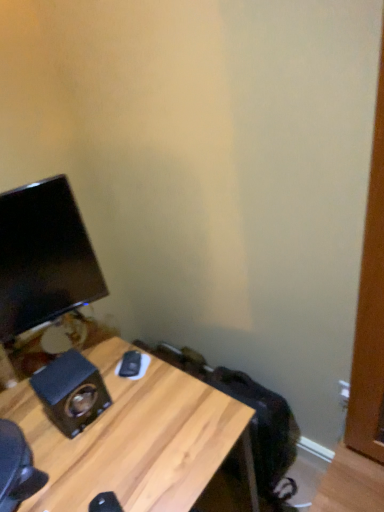
Describe the element at coordinates (44, 257) in the screenshot. I see `black glossy monitor at left` at that location.

At what (x,y) coordinates should I click in order to perform the action: click on black glossy monitor at left. Please return your answer as a coordinate pair (x, y). The height and width of the screenshot is (512, 384). Looking at the image, I should click on (44, 257).

I want to click on wooden desk at lower left, so (134, 440).

Where is `black glossy monitor at left`? This screenshot has height=512, width=384. black glossy monitor at left is located at coordinates (x=44, y=257).

Which of these two, wooden desk at lower left or wooden grain speaker at lower left, is bigger?

wooden desk at lower left is bigger.

Considering their positions, is wooden desk at lower left located in front of or behind wooden grain speaker at lower left?

Clearly, wooden desk at lower left is in front of wooden grain speaker at lower left.

Is wooden desk at lower left taller than wooden grain speaker at lower left?

Yes.

Would you consider wooden desk at lower left to be distant from wooden grain speaker at lower left?

No, wooden desk at lower left is not far away from wooden grain speaker at lower left.

From the image's perspective, which one is positioned lower, wooden desk at lower left or black glossy monitor at left?

wooden desk at lower left.

Find the location of `computer monitor that is behind the wooden desk at lower left`. computer monitor that is behind the wooden desk at lower left is located at coordinates (44, 257).

Is wooden desk at lower left far from black glossy monitor at left?

wooden desk at lower left is actually quite close to black glossy monitor at left.

Considering the sizes of objects wooden desk at lower left and black glossy monitor at left in the image provided, who is shorter, wooden desk at lower left or black glossy monitor at left?

black glossy monitor at left is shorter.

Relative to wooden desk at lower left, is black glossy monitor at left in front or behind?

black glossy monitor at left is behind wooden desk at lower left.

From a real-world perspective, which is physically above, black glossy monitor at left or wooden desk at lower left?

From a 3D spatial view, black glossy monitor at left is above.

Find the location of a particular element. The image size is (384, 512). computer monitor behind the wooden desk at lower left is located at coordinates (44, 257).

Are wooden grain speaker at lower left and wooden desk at lower left located far from each other?

No, wooden grain speaker at lower left is not far from wooden desk at lower left.

From a real-world perspective, which is physically below, wooden grain speaker at lower left or wooden desk at lower left?

wooden desk at lower left, from a real-world perspective.

Is wooden grain speaker at lower left positioned with its back to wooden desk at lower left?

No, wooden desk at lower left is not at the back of wooden grain speaker at lower left.

From the picture: From the image's perspective, which one is positioned higher, wooden grain speaker at lower left or wooden desk at lower left?

From the image's view, wooden grain speaker at lower left is above.

Is wooden grain speaker at lower left positioned with its back to black glossy monitor at left?

No, wooden grain speaker at lower left's orientation is not away from black glossy monitor at left.

Who is shorter, wooden grain speaker at lower left or black glossy monitor at left?

wooden grain speaker at lower left.

From a real-world perspective, which is physically below, wooden grain speaker at lower left or black glossy monitor at left?

In real-world perspective, wooden grain speaker at lower left is lower.

What's the angular difference between wooden grain speaker at lower left and black glossy monitor at left's facing directions?

12.9 degrees.

From a real-world perspective, is black glossy monitor at left positioned under wooden grain speaker at lower left based on gravity?

No, from a real-world perspective, black glossy monitor at left is not under wooden grain speaker at lower left.

Considering the sizes of objects black glossy monitor at left and wooden grain speaker at lower left in the image provided, who is shorter, black glossy monitor at left or wooden grain speaker at lower left?

wooden grain speaker at lower left is shorter.

Is black glossy monitor at left positioned with its back to wooden grain speaker at lower left?

No, wooden grain speaker at lower left is not at the back of black glossy monitor at left.

Considering the relative positions of black glossy monitor at left and wooden grain speaker at lower left in the image provided, is black glossy monitor at left behind wooden grain speaker at lower left?

No, black glossy monitor at left is closer to the viewer.

Find the location of a particular element. speaker located on the left of wooden desk at lower left is located at coordinates (71, 392).

What are the coordinates of `desk that appears below the black glossy monitor at left (from the image's perspective)` in the screenshot? It's located at (134, 440).

Considering their positions, is wooden desk at lower left positioned further to wooden grain speaker at lower left than black glossy monitor at left?

Among the two, black glossy monitor at left is located further to wooden grain speaker at lower left.

Looking at this image, considering their positions, is black glossy monitor at left positioned closer to wooden grain speaker at lower left than wooden desk at lower left?

Based on the image, wooden desk at lower left appears to be nearer to wooden grain speaker at lower left.

Based on their spatial positions, is wooden desk at lower left or wooden grain speaker at lower left closer to black glossy monitor at left?

wooden grain speaker at lower left lies closer to black glossy monitor at left than the other object.

Estimate the real-world distances between objects in this image. Which object is closer to black glossy monitor at left, wooden grain speaker at lower left or wooden desk at lower left?

The object closer to black glossy monitor at left is wooden grain speaker at lower left.

When comparing their distances from wooden desk at lower left, does black glossy monitor at left or wooden grain speaker at lower left seem further?

black glossy monitor at left lies further to wooden desk at lower left than the other object.

From the picture: From the image, which object appears to be farther from wooden desk at lower left, wooden grain speaker at lower left or black glossy monitor at left?

The object further to wooden desk at lower left is black glossy monitor at left.

At what (x,y) coordinates should I click in order to perform the action: click on speaker between black glossy monitor at left and wooden desk at lower left vertically. Please return your answer as a coordinate pair (x, y). Image resolution: width=384 pixels, height=512 pixels. Looking at the image, I should click on (71, 392).